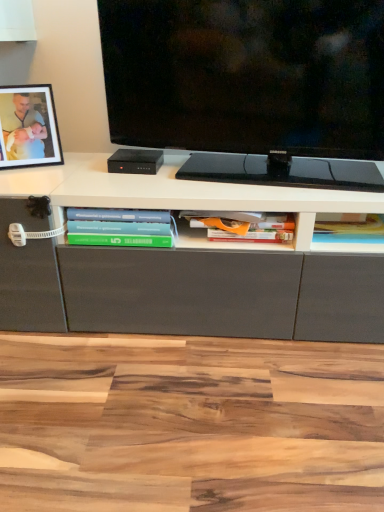
Find the location of a particular element. The height and width of the screenshot is (512, 384). blank space situated above hardcover book at center, the third book positioned from the left (from a real-world perspective) is located at coordinates (347, 223).